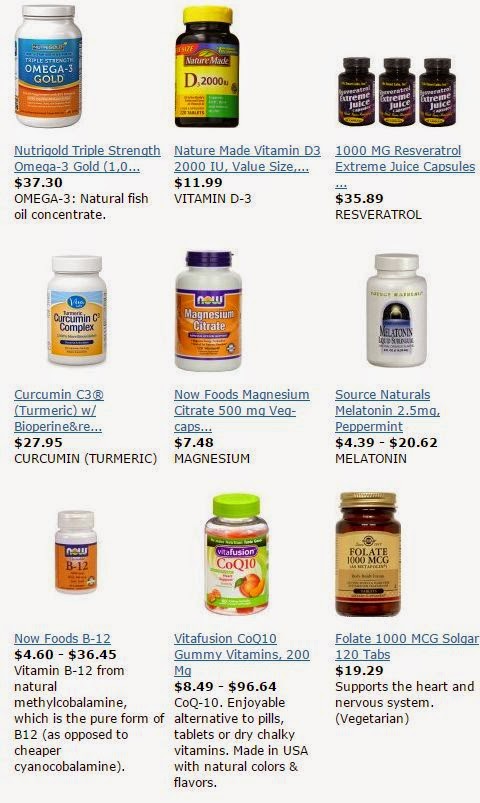
Find the location of a particular element. clear glass jar is located at coordinates (231, 528).